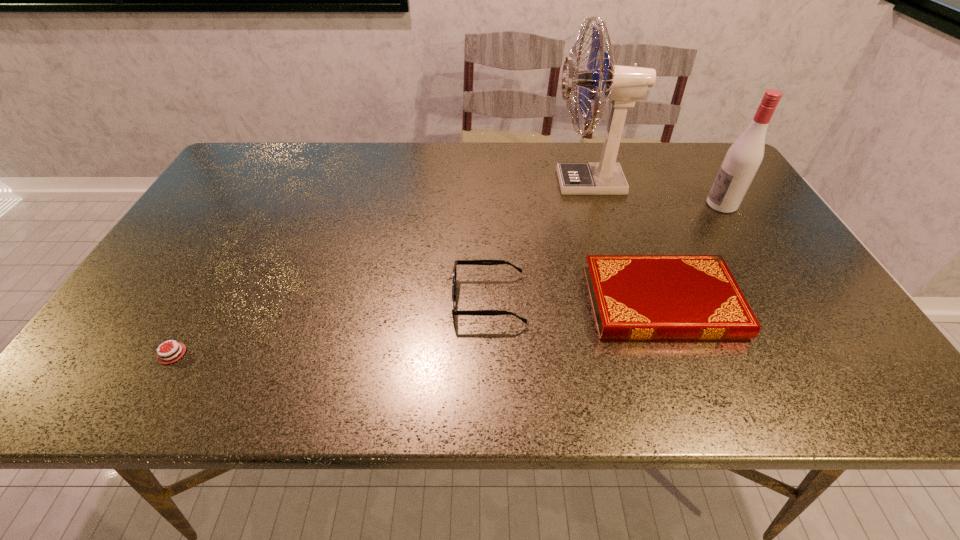
Find the location of a particular element. free space between the alcohol and the second shortest object is located at coordinates (692, 253).

In order to click on vacant space that's between the second object from left to right and the fourth tallest object in this screenshot , I will do `click(575, 301)`.

Find the location of a particular element. This screenshot has height=540, width=960. free area in between the fan and the second shortest object is located at coordinates (625, 242).

Find the location of a particular element. This screenshot has width=960, height=540. blank region between the second object from left to right and the hardback book is located at coordinates (575, 301).

Identify the location of free area in between the leftmost object and the alcohol. The height and width of the screenshot is (540, 960). coord(447,279).

The width and height of the screenshot is (960, 540). Identify the location of free space between the second tallest object and the shortest object. (447, 279).

Locate an element on the screen. The height and width of the screenshot is (540, 960). free space between the tallest object and the shortest object is located at coordinates (380, 268).

Image resolution: width=960 pixels, height=540 pixels. I want to click on blank region between the rightmost object and the shortest object, so click(x=447, y=279).

Locate an element on the screen. This screenshot has height=540, width=960. vacant area between the shortest object and the fan is located at coordinates click(380, 268).

The height and width of the screenshot is (540, 960). In order to click on free space between the shortest object and the alcohol in this screenshot , I will do `click(447, 279)`.